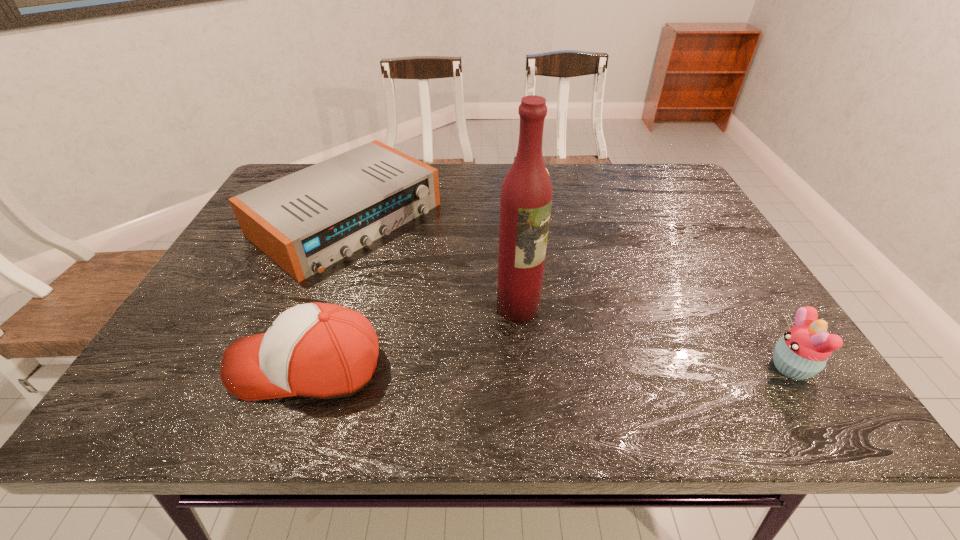
Locate an element on the screen. The height and width of the screenshot is (540, 960). vacant space situated 0.050m on the label of the liquor is located at coordinates (553, 330).

Locate an element on the screen. The width and height of the screenshot is (960, 540). radio receiver that is at the far edge is located at coordinates (306, 221).

This screenshot has width=960, height=540. I want to click on duck that is at the far edge, so click(x=545, y=167).

This screenshot has height=540, width=960. I want to click on baseball cap located in the near edge section of the desktop, so click(318, 350).

This screenshot has height=540, width=960. Find the location of `cupcake at the near edge`. cupcake at the near edge is located at coordinates (802, 352).

Where is `baseball cap located at the left edge`? baseball cap located at the left edge is located at coordinates (318, 350).

Locate an element on the screen. This screenshot has height=540, width=960. radio receiver located in the left edge section of the desktop is located at coordinates (306, 221).

Image resolution: width=960 pixels, height=540 pixels. In order to click on object that is at the right edge in this screenshot , I will do `click(802, 352)`.

Where is `object that is at the far left corner`? This screenshot has height=540, width=960. object that is at the far left corner is located at coordinates (306, 221).

Where is `object present at the near left corner`? This screenshot has width=960, height=540. object present at the near left corner is located at coordinates (318, 350).